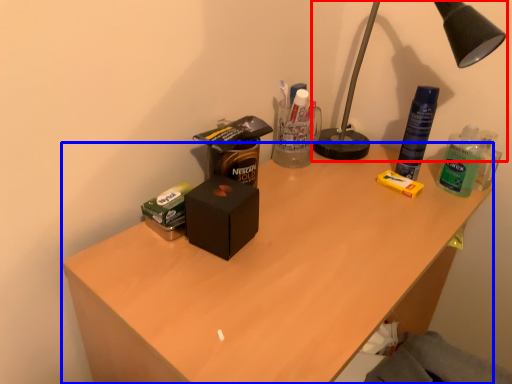
Question: Which object is further to the camera taking this photo, lamp (highlighted by a red box) or desk (highlighted by a blue box)?

Choices:
 (A) lamp
 (B) desk

Answer: (A)